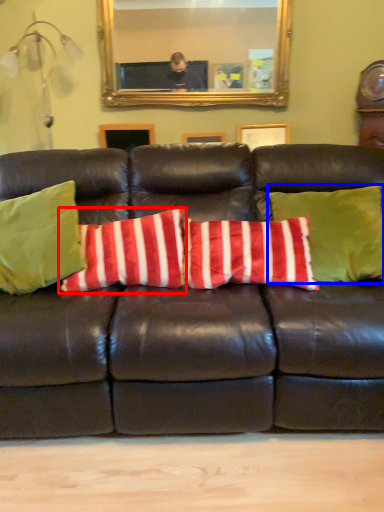
Question: Among these objects, which one is nearest to the camera, pillow (highlighted by a red box) or pillow (highlighted by a blue box)?

Choices:
 (A) pillow
 (B) pillow

Answer: (B)